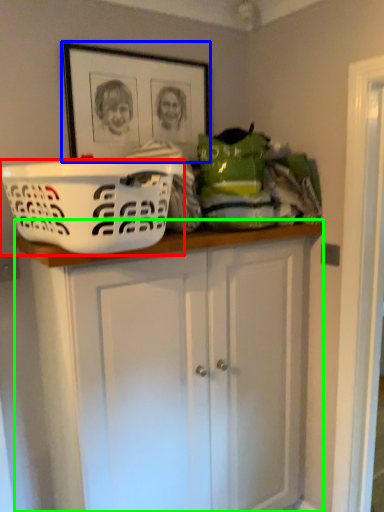
Question: Which is farther away from basket (highlighted by a red box)? picture frame (highlighted by a blue box) or cabinetry (highlighted by a green box)?

Choices:
 (A) picture frame
 (B) cabinetry

Answer: (A)